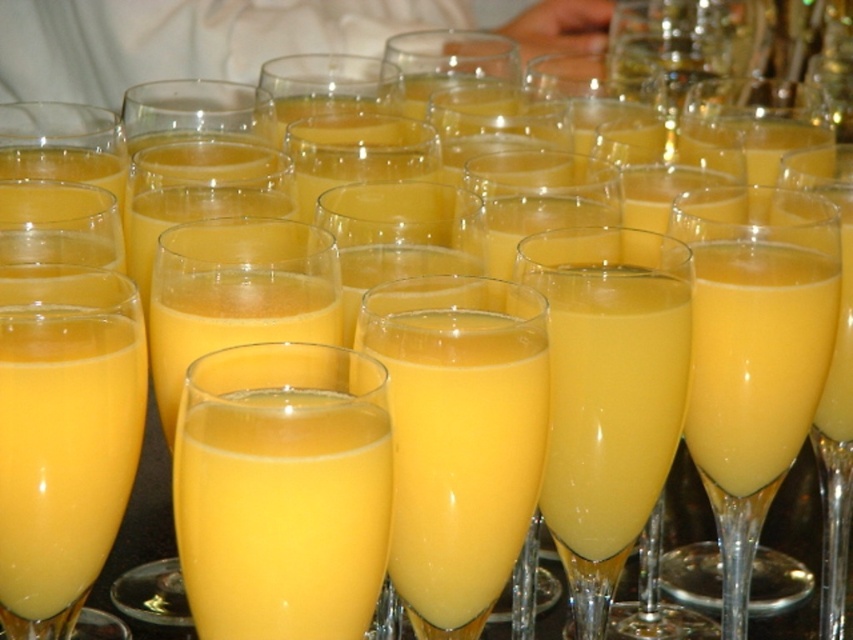
You are a bartender arranging drinks for a party. You have a translucent glass flute at center and a yellow translucent glass at center in front of you. Which glass is positioned higher when looking at them from the front?

The translucent glass flute at center is located above the yellow translucent glass at center, so it is positioned higher.

You are at a brunch event and see two points on the table where you can place your drink. The first point is at coordinate point (778, 483) and the second is at point (100, 541). Which point is closer to you?

Point (778, 483) is further to the camera than point (100, 541), so the point closer to you is point (100, 541).

You are a bartender arranging drinks for a party. You have a translucent glass flute at center and a yellow translucent glass at center on the table. Which glass is more to the right?

The translucent glass flute at center is positioned on the right side of the yellow translucent glass at center, so it is more to the right.